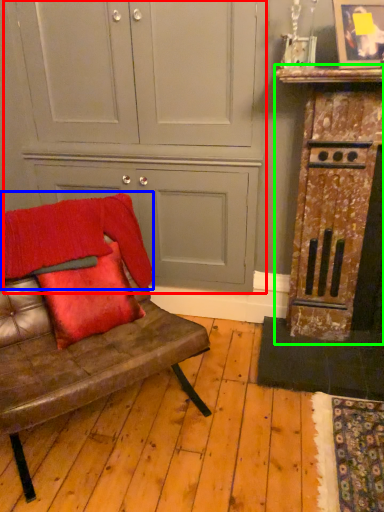
Question: Considering the real-world distances, which object is farthest from dresser (highlighted by a red box)? blanket (highlighted by a blue box) or dresser (highlighted by a green box)?

Choices:
 (A) blanket
 (B) dresser

Answer: (B)